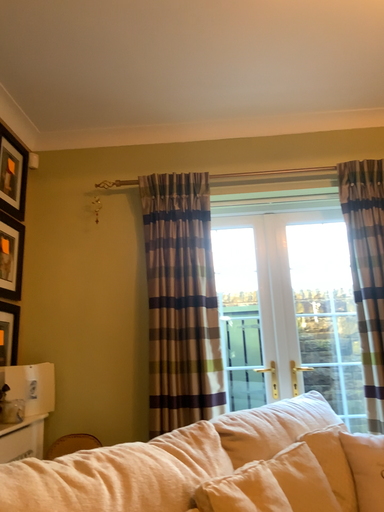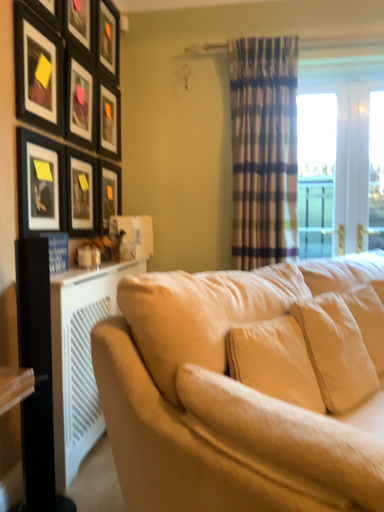
Question: How did the camera likely rotate when shooting the video?

Choices:
 (A) rotated right
 (B) rotated left

Answer: (B)